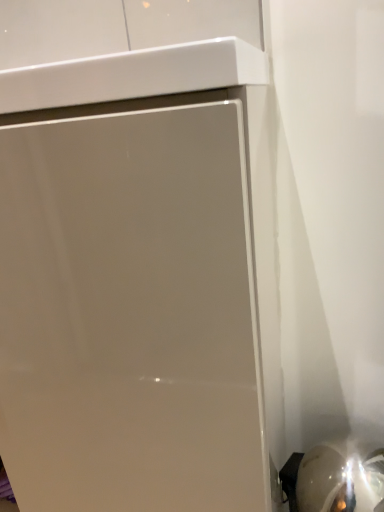
What is the approximate height of matte beige cabinet at center?

matte beige cabinet at center is 31.79 inches tall.

Where is `matte beige cabinet at center`? Image resolution: width=384 pixels, height=512 pixels. matte beige cabinet at center is located at coordinates click(139, 259).

The image size is (384, 512). What do you see at coordinates (139, 259) in the screenshot?
I see `matte beige cabinet at center` at bounding box center [139, 259].

Image resolution: width=384 pixels, height=512 pixels. I want to click on matte beige cabinet at center, so click(x=139, y=259).